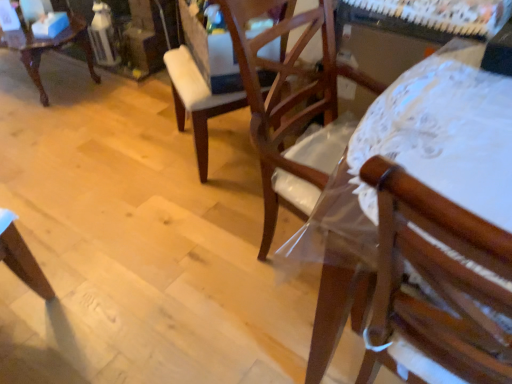
Question: Is matte white chair at upper left, which is counted as the first chair, starting from the left, located outside wooden chair at right, which is counted as the 1th chair, starting from the right?

Choices:
 (A) yes
 (B) no

Answer: (A)

Question: From a real-world perspective, is matte white chair at upper left, the 3th chair from the right, on top of wooden chair at right, which is counted as the 1th chair, starting from the right?

Choices:
 (A) no
 (B) yes

Answer: (A)

Question: Considering the relative sizes of matte white chair at upper left, which ranks as the 1th chair in back-to-front order, and wooden chair at right, the third chair viewed from the back, in the image provided, is matte white chair at upper left, which ranks as the 1th chair in back-to-front order, taller than wooden chair at right, the third chair viewed from the back,?

Choices:
 (A) no
 (B) yes

Answer: (A)

Question: Is matte white chair at upper left, the 3th chair in the front-to-back sequence, positioned with its back to wooden chair at right, the third chair viewed from the left?

Choices:
 (A) no
 (B) yes

Answer: (A)

Question: Does matte white chair at upper left, the 3th chair in the front-to-back sequence, have a larger size compared to wooden chair at right, which ranks as the 1th chair in front-to-back order?

Choices:
 (A) no
 (B) yes

Answer: (B)

Question: Would you consider matte white chair at upper left, the 3th chair from the right, to be distant from wooden chair at right, which is counted as the 1th chair, starting from the right?

Choices:
 (A) yes
 (B) no

Answer: (A)

Question: Can you confirm if wooden chair at center, which ranks as the second chair in front-to-back order, is taller than wooden chair at right, the third chair viewed from the left?

Choices:
 (A) no
 (B) yes

Answer: (A)

Question: Are wooden chair at center, the 2th chair positioned from the right, and wooden chair at right, which is counted as the 1th chair, starting from the right, located far from each other?

Choices:
 (A) yes
 (B) no

Answer: (B)

Question: Is wooden chair at center, which is the 2th chair from back to front, next to wooden chair at right, the third chair viewed from the left?

Choices:
 (A) yes
 (B) no

Answer: (B)

Question: Does wooden chair at center, arranged as the second chair when viewed from the left, have a lesser width compared to wooden chair at right, which ranks as the 1th chair in front-to-back order?

Choices:
 (A) yes
 (B) no

Answer: (A)

Question: From a real-world perspective, does wooden chair at center, which is the 2th chair from back to front, sit lower than wooden chair at right, which ranks as the 1th chair in front-to-back order?

Choices:
 (A) yes
 (B) no

Answer: (A)

Question: Is the depth of wooden chair at center, which ranks as the second chair in front-to-back order, less than that of wooden chair at right, the third chair viewed from the back?

Choices:
 (A) no
 (B) yes

Answer: (A)

Question: Considering the relative positions of wooden chair at right, the third chair viewed from the back, and wooden chair at center, arranged as the second chair when viewed from the left, in the image provided, is wooden chair at right, the third chair viewed from the back, in front of wooden chair at center, arranged as the second chair when viewed from the left,?

Choices:
 (A) no
 (B) yes

Answer: (B)